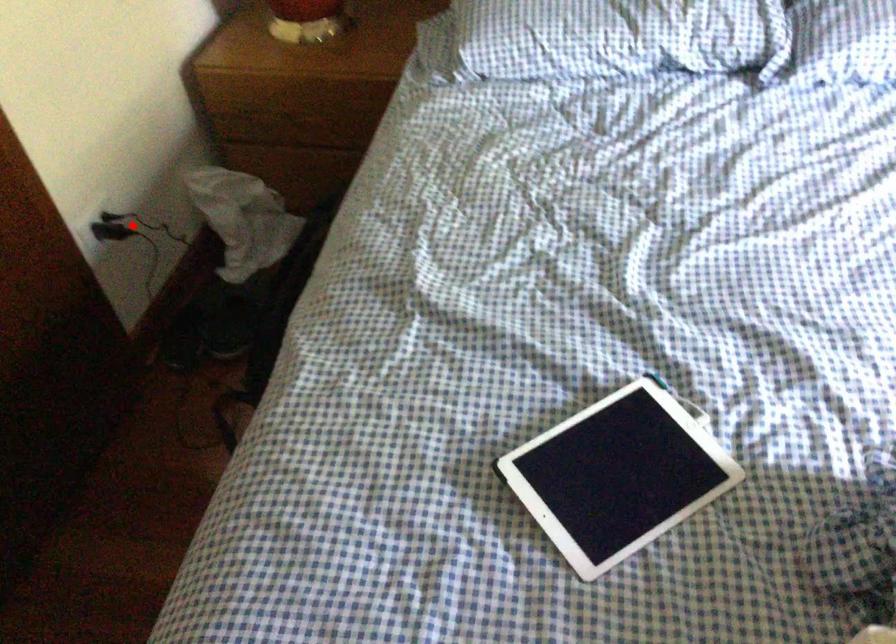
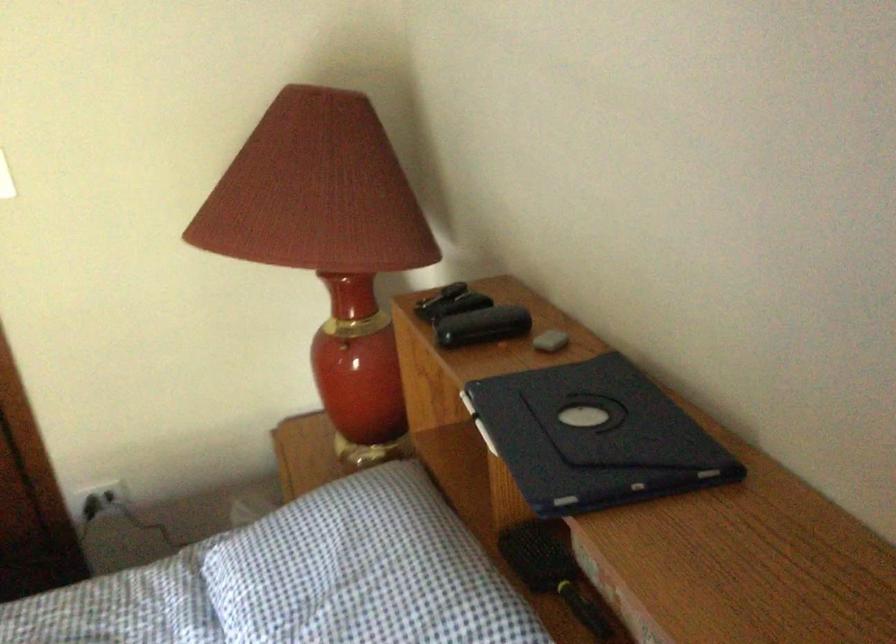
The point at the highlighted location is marked in the first image. Where is the corresponding point in the second image?

(99, 500)